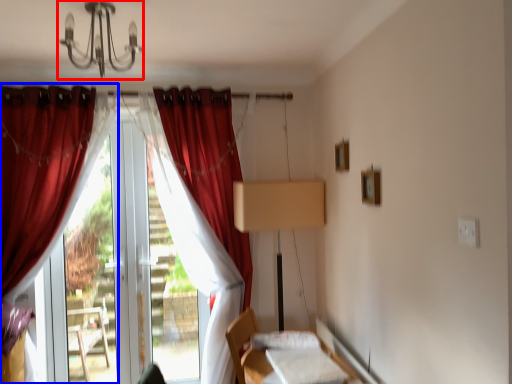
Question: Which of the following is the closest to the observer, light fixture (highlighted by a red box) or curtain (highlighted by a blue box)?

Choices:
 (A) light fixture
 (B) curtain

Answer: (A)